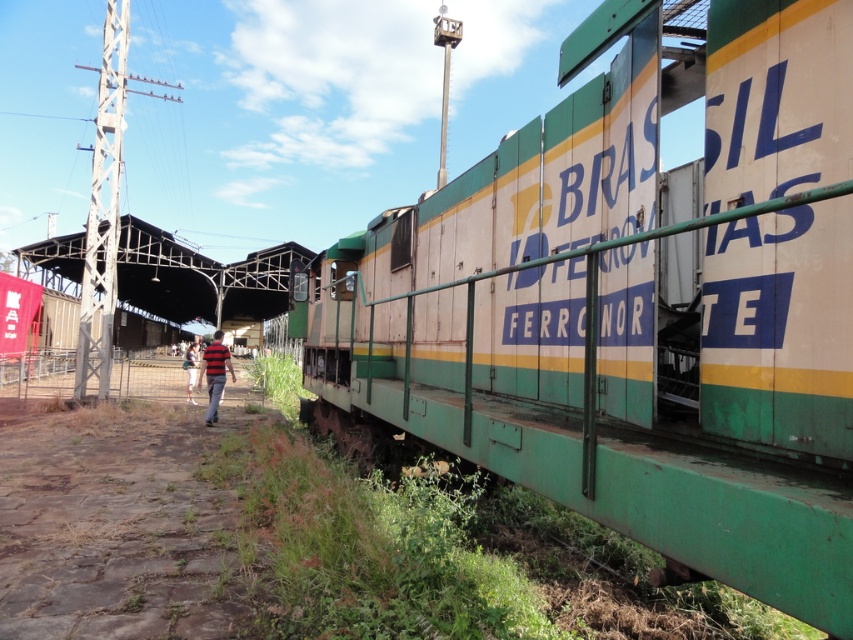
Question: Can you confirm if brown stone dirt track at lower left is positioned above white cotton shirt at center?

Choices:
 (A) no
 (B) yes

Answer: (A)

Question: Among these objects, which one is nearest to the camera?

Choices:
 (A) brown stone dirt track at lower left
 (B) green painted metal train car at right
 (C) white cotton shirt at center

Answer: (B)

Question: Which object is positioned farthest from the white cotton shirt at center?

Choices:
 (A) striped shirt at center
 (B) green painted metal train car at right
 (C) brown stone dirt track at lower left

Answer: (B)

Question: Is green painted metal train car at right bigger than brown stone dirt track at lower left?

Choices:
 (A) yes
 (B) no

Answer: (A)

Question: Which object appears farthest from the camera in this image?

Choices:
 (A) brown stone dirt track at lower left
 (B) striped shirt at center
 (C) green painted metal train car at right
 (D) white cotton shirt at center

Answer: (D)

Question: Can you confirm if green painted metal train car at right is positioned below striped shirt at center?

Choices:
 (A) no
 (B) yes

Answer: (A)